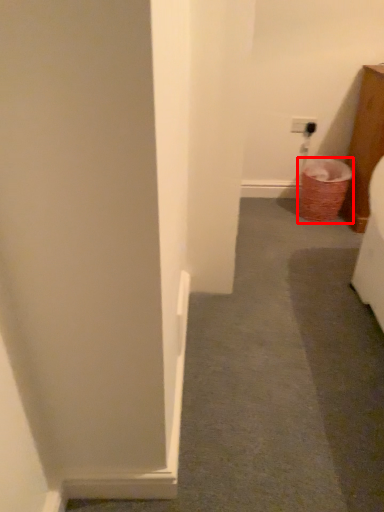
Question: From the image's perspective, what is the correct spatial relationship of laundry basket (annotated by the red box) in relation to path?

Choices:
 (A) below
 (B) above

Answer: (B)